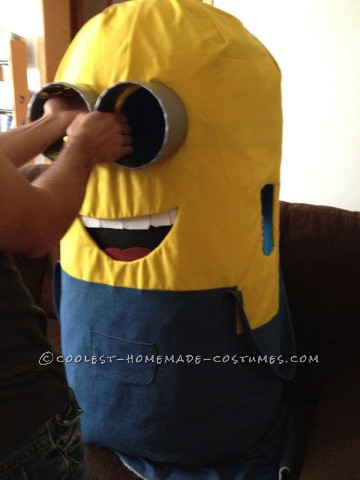
Locate an element on the screen. The image size is (360, 480). white wall is located at coordinates (320, 174).